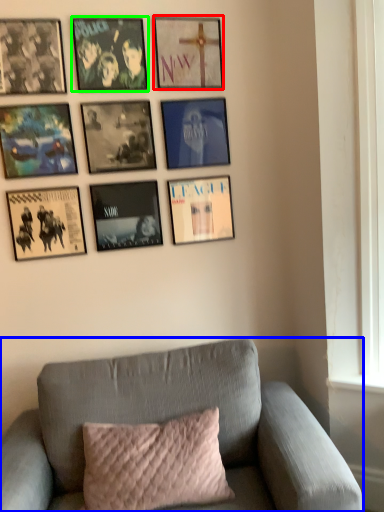
Question: Based on their relative distances, which object is farther from picture frame (highlighted by a red box)? Choose from studio couch (highlighted by a blue box) and picture frame (highlighted by a green box).

Choices:
 (A) studio couch
 (B) picture frame

Answer: (A)